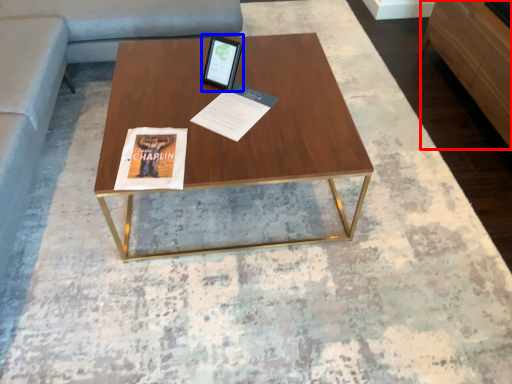
Question: Which point is closer to the camera, furniture (highlighted by a red box) or tablet computer (highlighted by a blue box)?

Choices:
 (A) furniture
 (B) tablet computer

Answer: (B)